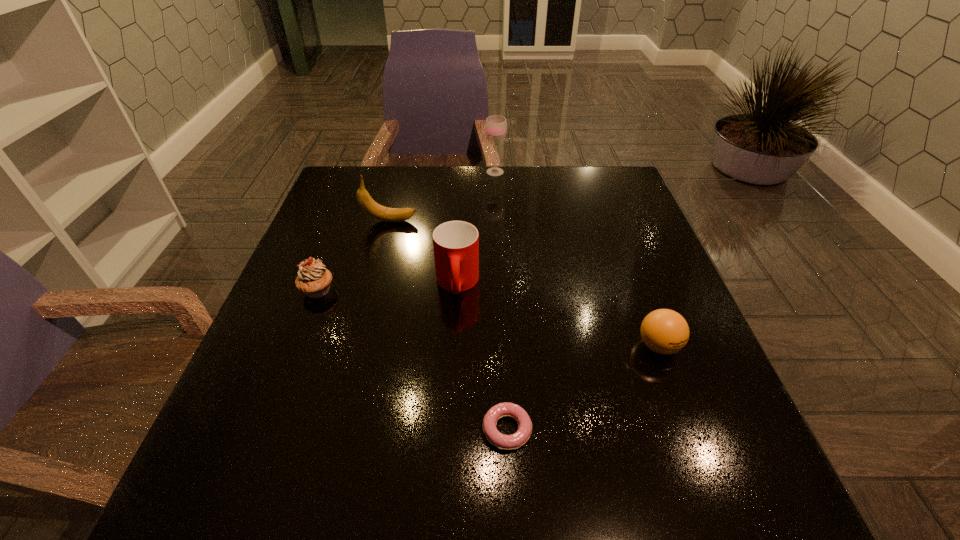
In order to click on blank area in the image that satisfies the following two spatial constraints: 1. on the side of the doughnut with the handle; 2. on the left side of the third object from left to right in this screenshot , I will do `click(449, 429)`.

Where is `free location that satisfies the following two spatial constraints: 1. at the start of the peel on the fifth nearest object; 2. on the left side of the shortest object`? This screenshot has width=960, height=540. free location that satisfies the following two spatial constraints: 1. at the start of the peel on the fifth nearest object; 2. on the left side of the shortest object is located at coordinates (337, 429).